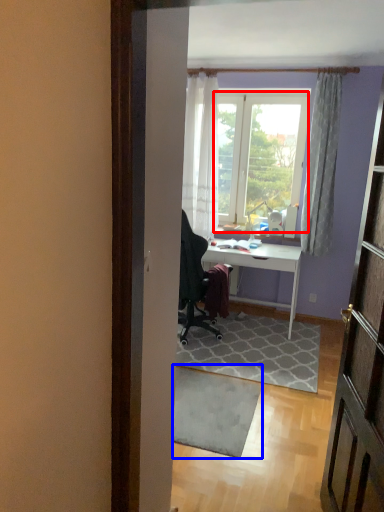
Question: Which of the following is the farthest to the observer, window screen (highlighted by a red box) or doormat (highlighted by a blue box)?

Choices:
 (A) window screen
 (B) doormat

Answer: (A)